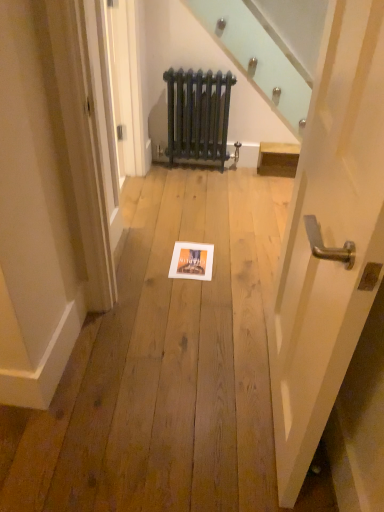
In order to click on free spot below dark blue cast iron radiator at center (from a real-world perspective) in this screenshot , I will do `click(201, 161)`.